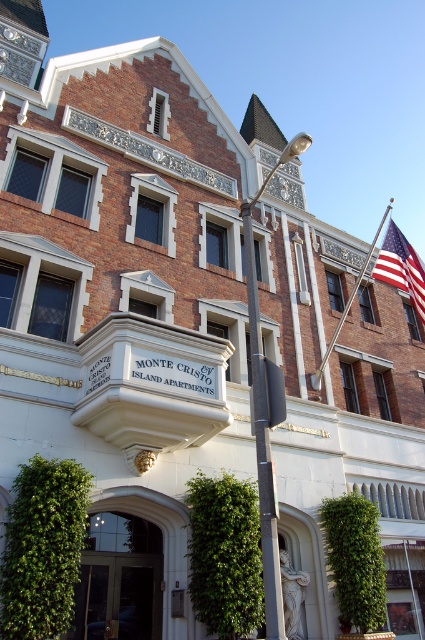
What is the location of the point with coordinates (401, 268) in the image?

The point with coordinates (401, 268) is located on the American flag at the upper right of the image.

You are standing in front of the building and want to place a new sign between the metallic pole at center and the metallic flag pole at upper right. Based on their positions, which side of the flag pole should the sign be placed on?

The metallic pole at center is to the left of the metallic flag pole at upper right, so the sign should be placed to the left side of the metallic flag pole at upper right.

You are standing at the entrance of the building and want to find the metallic pole at center. According to the coordinates provided, where should you look relative to your position?

The metallic pole at center is located at coordinates point (265, 412), which means it is positioned to the right and slightly below your current position at the entrance.